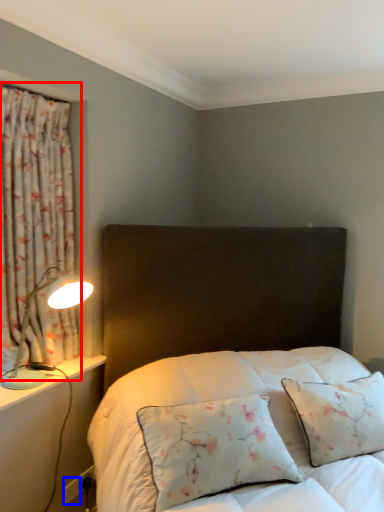
Question: Which object is further to the camera taking this photo, curtain (highlighted by a red box) or electric outlet (highlighted by a blue box)?

Choices:
 (A) curtain
 (B) electric outlet

Answer: (B)